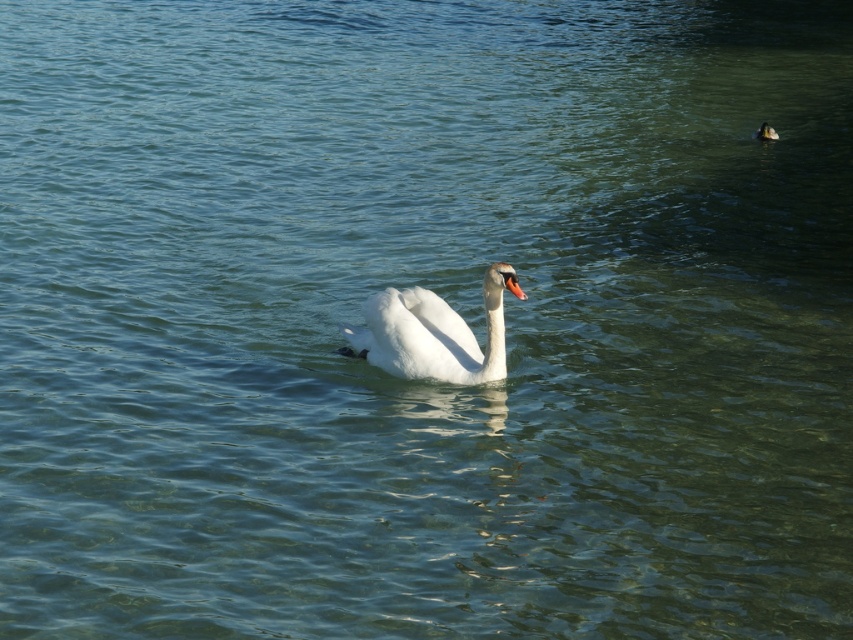
Question: Which of the following is the farthest from the observer?

Choices:
 (A) (770, 132)
 (B) (450, 346)

Answer: (A)

Question: Does white glossy swan at center have a greater width compared to white matte duck at center?

Choices:
 (A) yes
 (B) no

Answer: (A)

Question: Can you confirm if white glossy swan at center is positioned to the right of white matte duck at center?

Choices:
 (A) no
 (B) yes

Answer: (A)

Question: Does white glossy swan at center appear under white matte duck at center?

Choices:
 (A) no
 (B) yes

Answer: (B)

Question: Which of the following is the closest to the observer?

Choices:
 (A) (753, 134)
 (B) (502, 282)

Answer: (B)